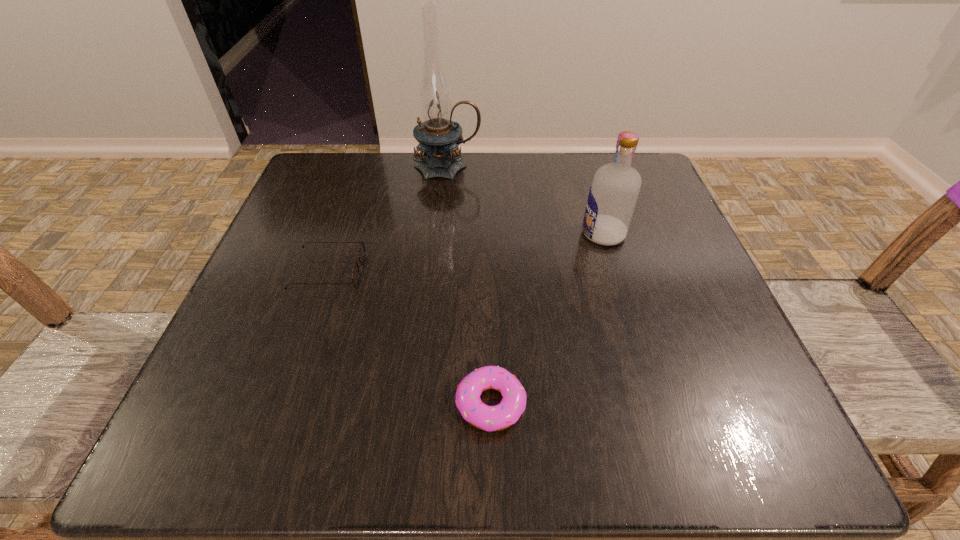
Where is `vacant position located on the label of the third nearest object`? vacant position located on the label of the third nearest object is located at coordinates (540, 234).

The height and width of the screenshot is (540, 960). I want to click on vacant space located on the front-facing side of the leftmost object, so click(429, 272).

I want to click on free region located on the left of the nearest object, so point(201,404).

The height and width of the screenshot is (540, 960). What are the coordinates of `object that is at the far edge` in the screenshot? It's located at (438, 137).

I want to click on object situated at the near edge, so click(x=489, y=418).

Locate an element on the screen. Image resolution: width=960 pixels, height=540 pixels. object situated at the left edge is located at coordinates (361, 254).

This screenshot has width=960, height=540. In order to click on object that is at the right edge in this screenshot , I will do `click(613, 194)`.

Identify the location of vacant point at the far edge. (439, 193).

Where is `free space at the near edge of the desktop`? free space at the near edge of the desktop is located at coordinates (432, 440).

I want to click on vacant space at the left edge of the desktop, so click(250, 327).